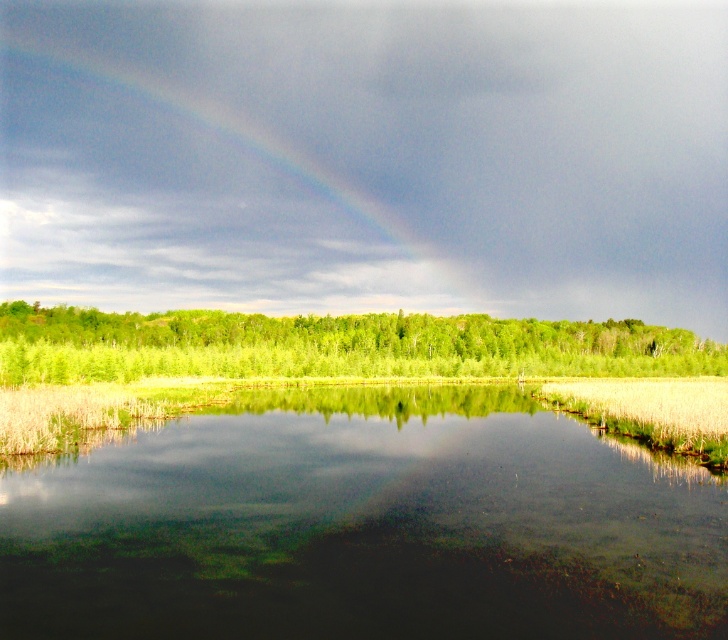
Question: Which of the following is the closest to the observer?

Choices:
 (A) (480, 360)
 (B) (126, 196)
 (C) (553, 614)

Answer: (C)

Question: Can you confirm if clear water at center is positioned to the right of green leafy trees at center?

Choices:
 (A) no
 (B) yes

Answer: (A)

Question: Does clear water at center have a smaller size compared to rainbow at upper center?

Choices:
 (A) yes
 (B) no

Answer: (A)

Question: Which point is closer to the camera?

Choices:
 (A) (7, 310)
 (B) (213, 627)

Answer: (B)

Question: Is rainbow at upper center behind green leafy trees at center?

Choices:
 (A) yes
 (B) no

Answer: (A)

Question: Based on their relative distances, which object is nearer to the clear water at center?

Choices:
 (A) green leafy trees at center
 (B) rainbow at upper center

Answer: (A)